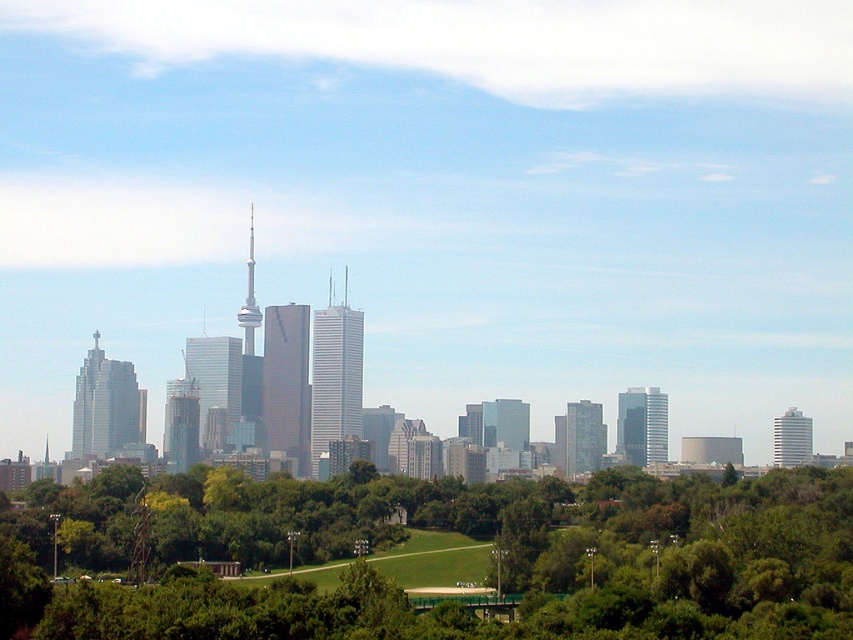
Is point (637, 432) closer to camera compared to point (592, 403)?

No, (637, 432) is further to viewer.

In order to click on glassy silver skyscraper at center-right in this screenshot , I will do `click(642, 426)`.

Is point (631, 410) less distant than point (593, 467)?

Yes, it is in front of point (593, 467).

Find the location of `glassy silver skyscraper at center-right`. glassy silver skyscraper at center-right is located at coordinates (642, 426).

Between point (376, 566) and point (573, 444), which one is positioned behind?

The point (376, 566) is more distant.

Does green grassy field at center lie behind green glass building at center?

Yes, it is.

Does point (473, 563) lie behind point (573, 404)?

Yes, it is behind point (573, 404).

The image size is (853, 640). Identify the location of green grassy field at center. (434, 561).

Who is taller, green leafy tree at center or matte glass skyscraper at center-left?

green leafy tree at center is taller.

Is green leafy tree at center positioned behind matte glass skyscraper at center-left?

No, it is in front of matte glass skyscraper at center-left.

At what (x,y) coordinates should I click in order to perform the action: click on green leafy tree at center. Please return your answer as a coordinate pair (x, y). Looking at the image, I should click on (433, 577).